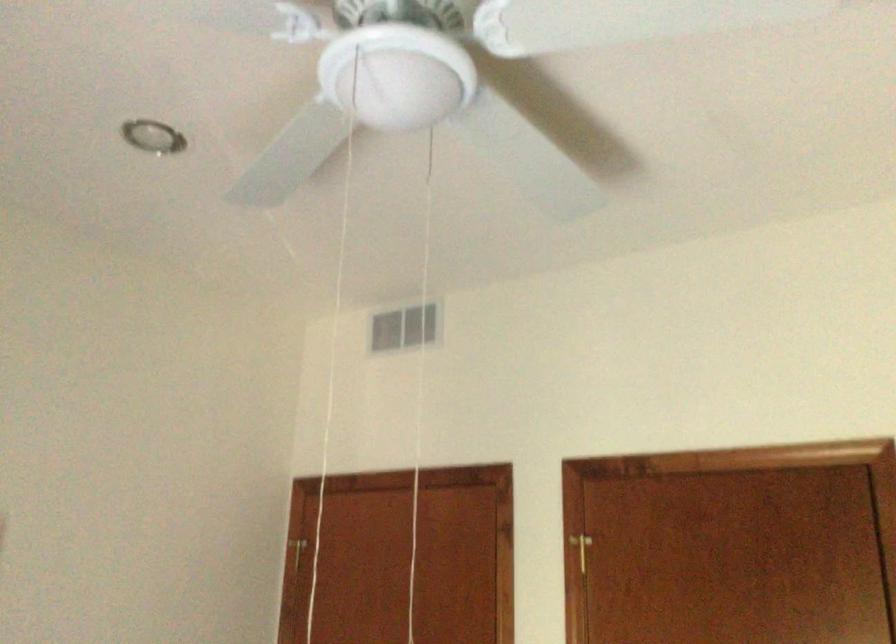
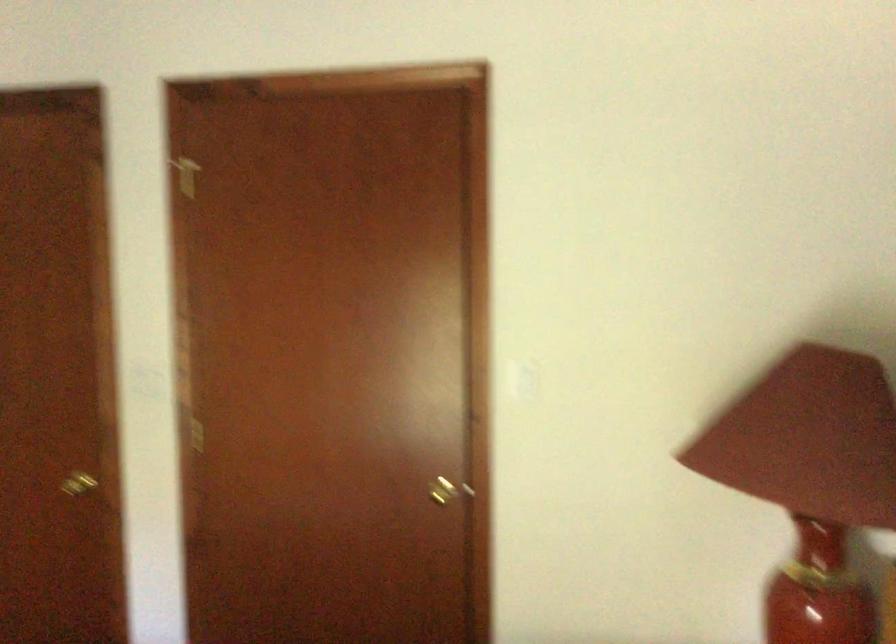
How did the camera likely rotate?

The camera rotated toward right-down.